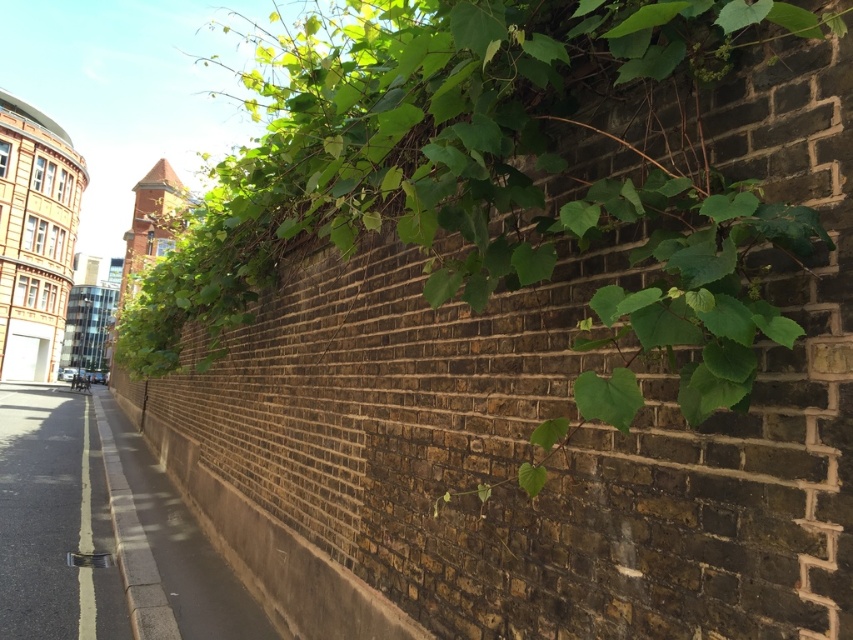
Does green leafy plant at upper center have a greater width compared to black asphalt at lower left?

No, green leafy plant at upper center is not wider than black asphalt at lower left.

Can you confirm if green leafy plant at upper center is shorter than black asphalt at lower left?

No.

What do you see at coordinates (495, 180) in the screenshot? Image resolution: width=853 pixels, height=640 pixels. I see `green leafy plant at upper center` at bounding box center [495, 180].

Locate an element on the screen. The image size is (853, 640). green leafy plant at upper center is located at coordinates (495, 180).

Between black asphalt at lower left and gray concrete sidewalk at lower left, which one appears on the left side from the viewer's perspective?

From the viewer's perspective, black asphalt at lower left appears more on the left side.

Which is behind, point (28, 528) or point (157, 544)?

Positioned behind is point (28, 528).

Image resolution: width=853 pixels, height=640 pixels. I want to click on black asphalt at lower left, so pos(54,520).

Is green leafy plant at upper center positioned at the back of gray concrete sidewalk at lower left?

That is False.

Between point (315, 161) and point (154, 538), which one is positioned in front?

Point (315, 161) is in front.

The width and height of the screenshot is (853, 640). What do you see at coordinates (495, 180) in the screenshot?
I see `green leafy plant at upper center` at bounding box center [495, 180].

The image size is (853, 640). Identify the location of green leafy plant at upper center. (495, 180).